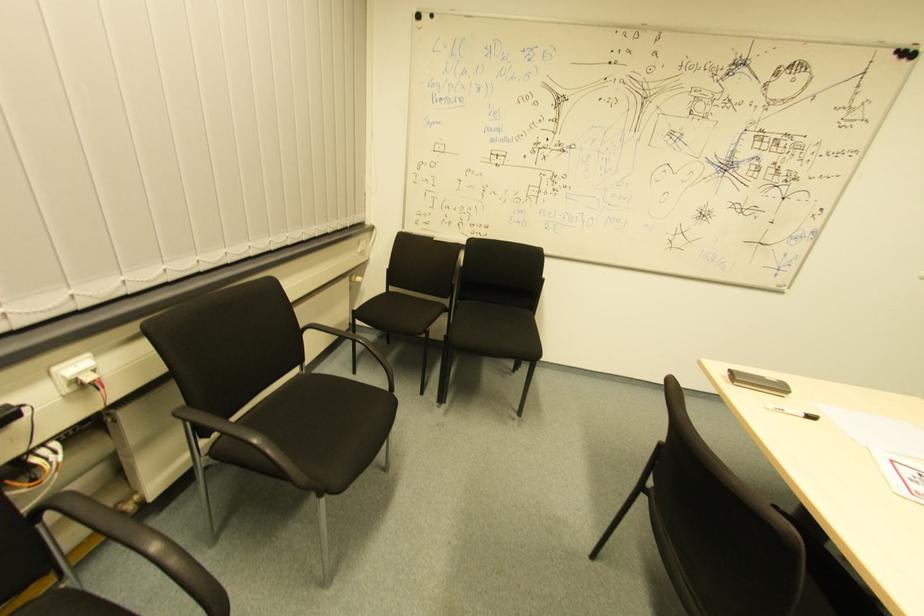
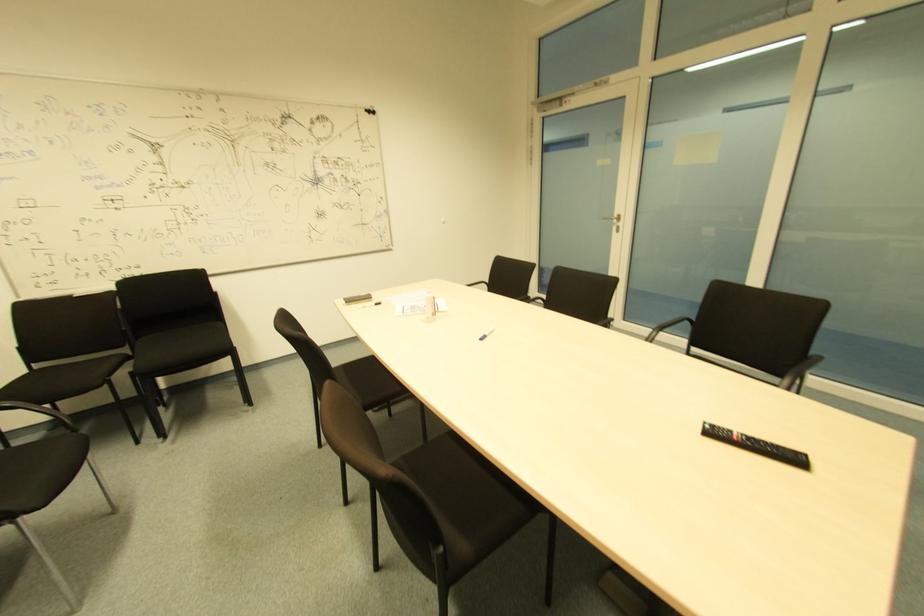
Where in the second image is the point corresponding to (x=391, y=292) from the first image?

(34, 370)